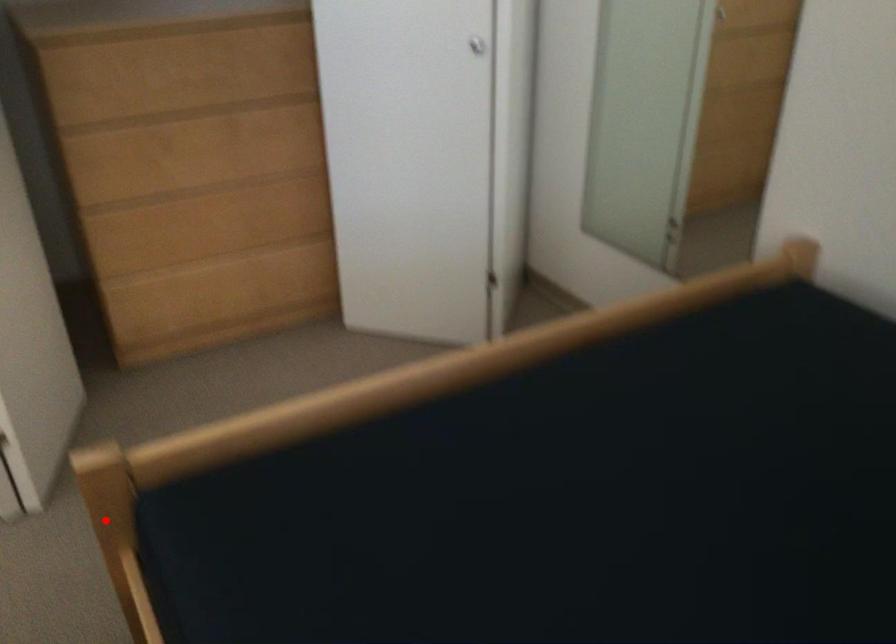
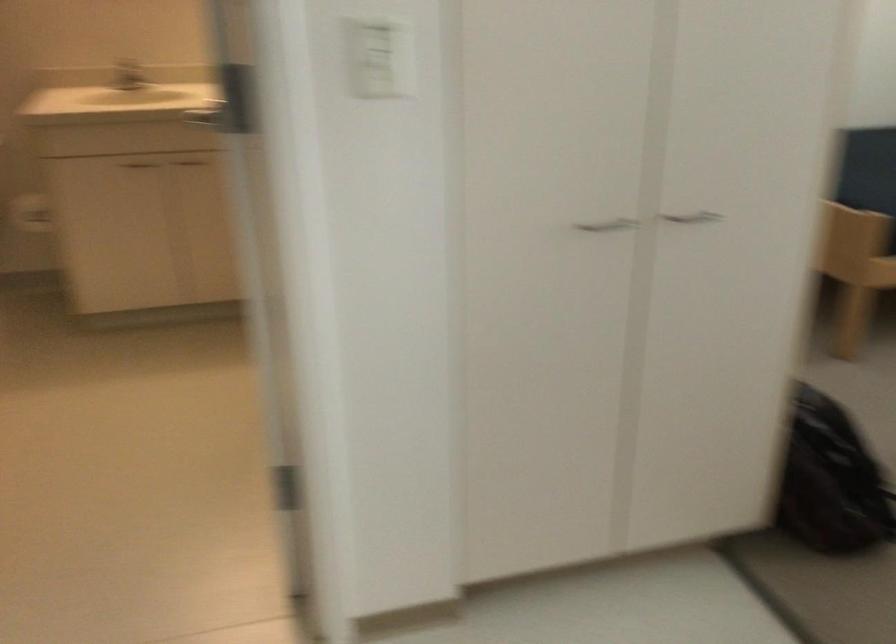
Question: A red point is marked in image1. In image2, is the corresponding 3D point closer to the camera or farther? Reply with the corresponding letter.

Choices:
 (A) The corresponding 3D point is closer.
 (B) The corresponding 3D point is farther.

Answer: (B)